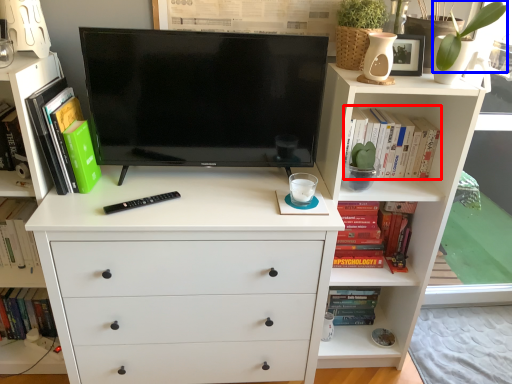
Question: Among these objects, which one is farthest to the camera, book (highlighted by a red box) or plant (highlighted by a blue box)?

Choices:
 (A) book
 (B) plant

Answer: (A)